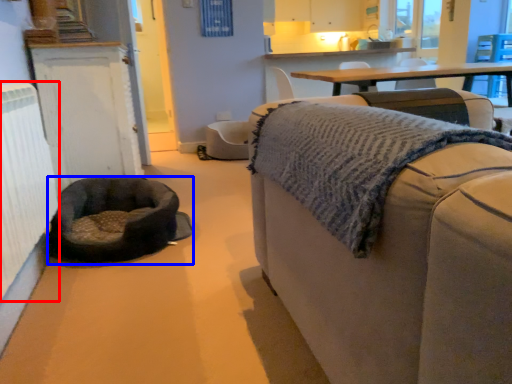
Question: Which object appears farthest to the camera in this image, radiator (highlighted by a red box) or dog bed (highlighted by a blue box)?

Choices:
 (A) radiator
 (B) dog bed

Answer: (B)